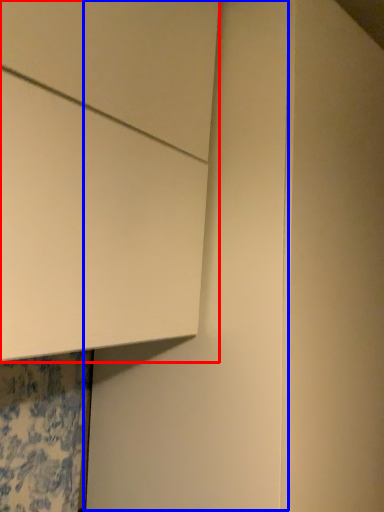
Question: Which of the following is the closest to the observer, cabinetry (highlighted by a red box) or door (highlighted by a blue box)?

Choices:
 (A) cabinetry
 (B) door

Answer: (A)